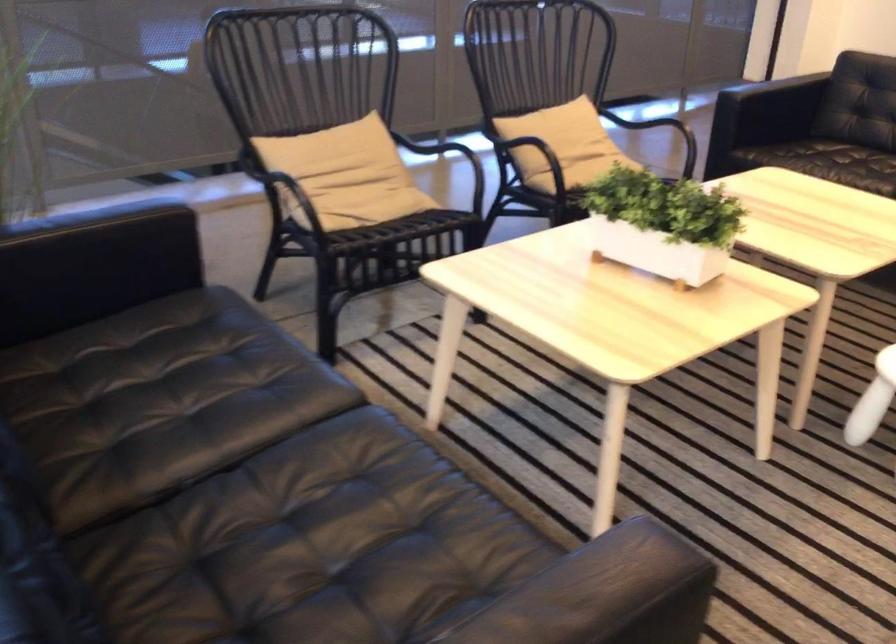
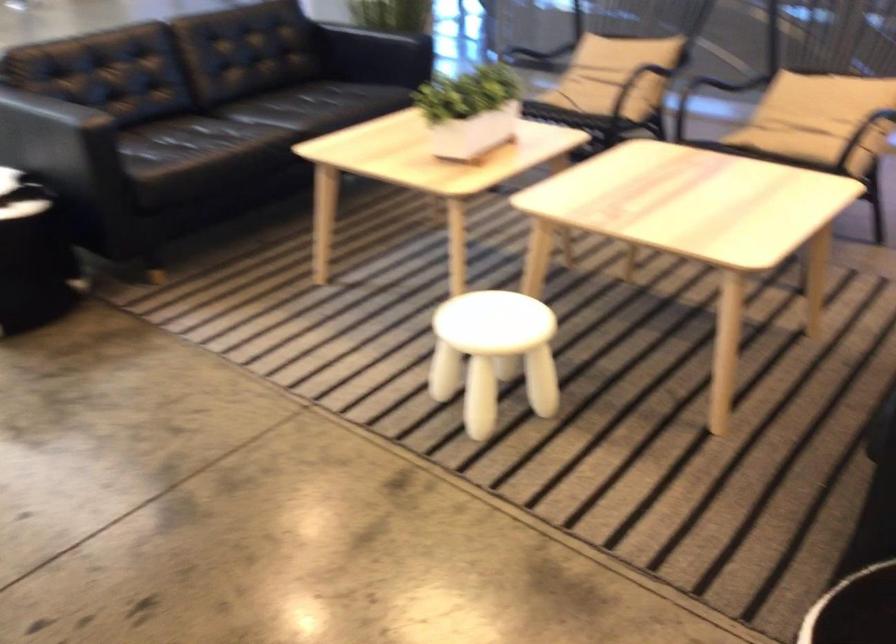
The point at (x=677, y=214) is marked in the first image. Where is the corresponding point in the second image?

(470, 111)